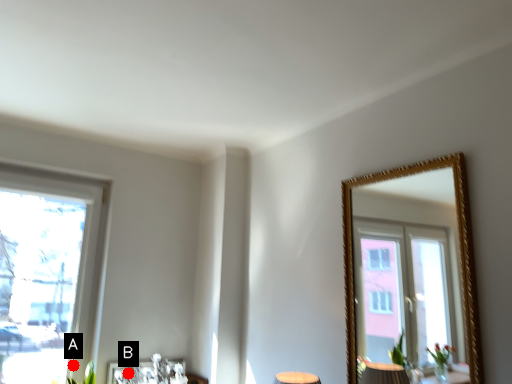
Question: Two points are circled on the image, labeled by A and B beside each circle. Which of the following is the closest to the observer?

Choices:
 (A) A is closer
 (B) B is closer

Answer: (A)